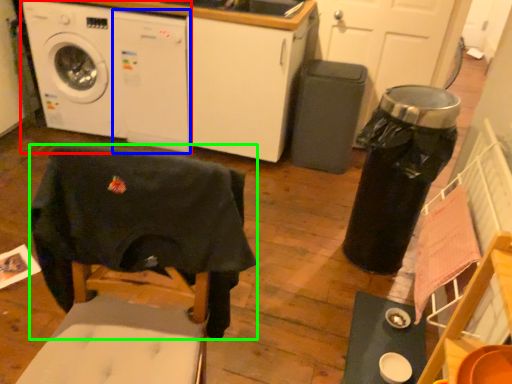
Question: Considering the real-world distances, which object is farthest from washing machine (highlighted by a red box)? washing machine (highlighted by a blue box) or swivel chair (highlighted by a green box)?

Choices:
 (A) washing machine
 (B) swivel chair

Answer: (B)